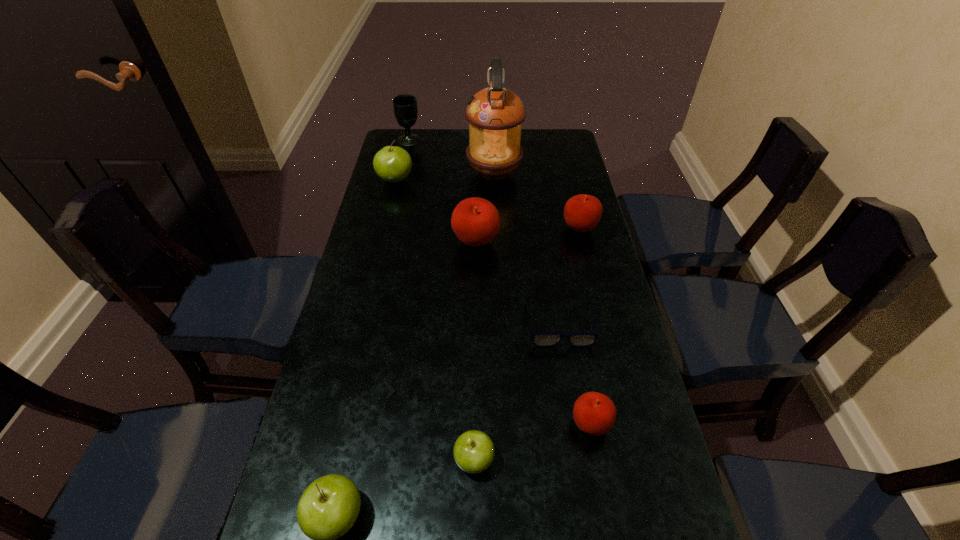
The image size is (960, 540). Identify the location of unoccupied position between the smallest red apple and the second smallest red apple. (585, 326).

In order to click on unoccupied area between the smallest green apple and the biggest red apple in this screenshot , I will do `click(475, 352)`.

Locate an element on the screen. The width and height of the screenshot is (960, 540). empty space that is in between the second biggest red apple and the leftmost red apple is located at coordinates (528, 235).

In order to click on free space between the shortest object and the leftmost red apple in this screenshot , I will do `click(517, 283)`.

This screenshot has width=960, height=540. I want to click on blank region between the oil lamp and the nearest red apple, so [x=542, y=299].

Locate an element on the screen. vacant area between the second smallest red apple and the farthest object is located at coordinates (494, 184).

Identify the location of free spot between the oil lamp and the rightmost green apple. (484, 316).

Where is `object that ranks as the sixth closest to the second biggest red apple`? The width and height of the screenshot is (960, 540). object that ranks as the sixth closest to the second biggest red apple is located at coordinates (405, 108).

Where is `the fifth closest object relative to the second farthest green apple`? Image resolution: width=960 pixels, height=540 pixels. the fifth closest object relative to the second farthest green apple is located at coordinates coord(582,212).

The image size is (960, 540). Identify the location of apple that is the fifth closest to the oil lamp. (473, 451).